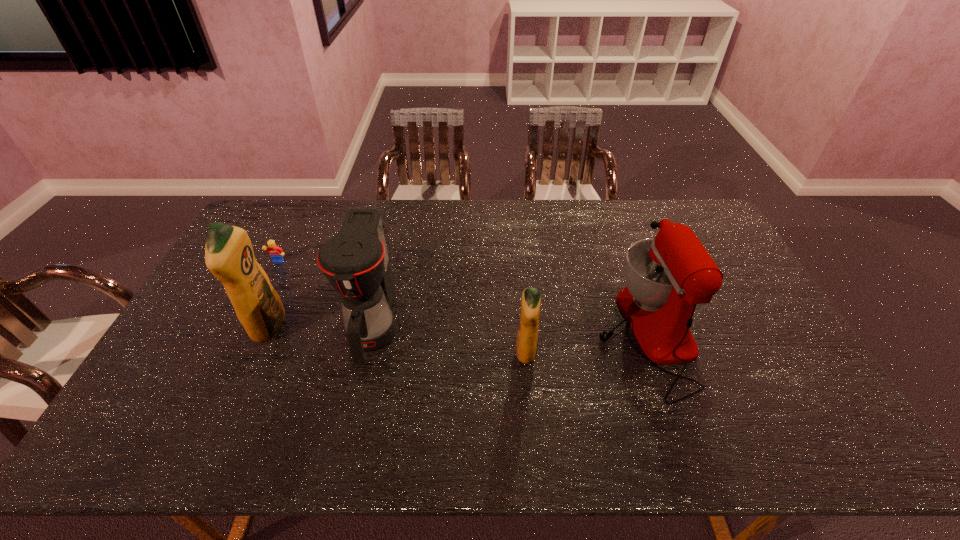
Image resolution: width=960 pixels, height=540 pixels. In order to click on object that is at the left edge in this screenshot , I will do `click(275, 252)`.

At what (x,y) coordinates should I click in order to perform the action: click on free space at the far edge of the desktop. Please return your answer as a coordinate pair (x, y). Looking at the image, I should click on (529, 206).

Find the location of `free space at the far left corner of the desktop`. free space at the far left corner of the desktop is located at coordinates (294, 218).

Where is `free space at the near right corner of the desktop`? The width and height of the screenshot is (960, 540). free space at the near right corner of the desktop is located at coordinates (794, 408).

Find the location of a particular element. vacant area that lies between the left detergent and the coffee maker is located at coordinates (321, 327).

The image size is (960, 540). I want to click on unoccupied position between the taller detergent and the right detergent, so click(397, 340).

Where is `empty space between the rightmost object and the fifth nearest object`? empty space between the rightmost object and the fifth nearest object is located at coordinates (462, 298).

Locate an element on the screen. free area in between the coffee maker and the rightmost object is located at coordinates (509, 330).

I want to click on free space that is in between the coffee maker and the shorter detergent, so click(449, 340).

Find the location of a particular element. The height and width of the screenshot is (540, 960). free space between the rightmost object and the coffee maker is located at coordinates (509, 330).